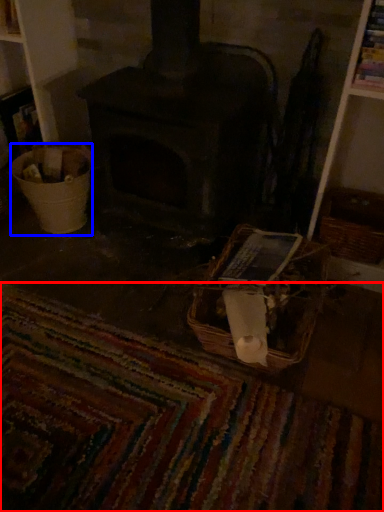
Question: Which point is closer to the camera, mat (highlighted by a red box) or basket container (highlighted by a blue box)?

Choices:
 (A) mat
 (B) basket container

Answer: (A)